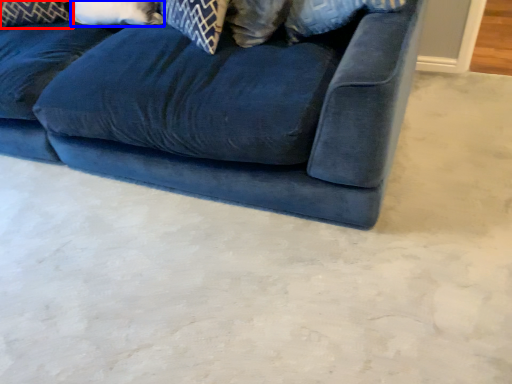
Question: Which of the following is the closest to the observer, pillow (highlighted by a red box) or pillow (highlighted by a blue box)?

Choices:
 (A) pillow
 (B) pillow

Answer: (B)